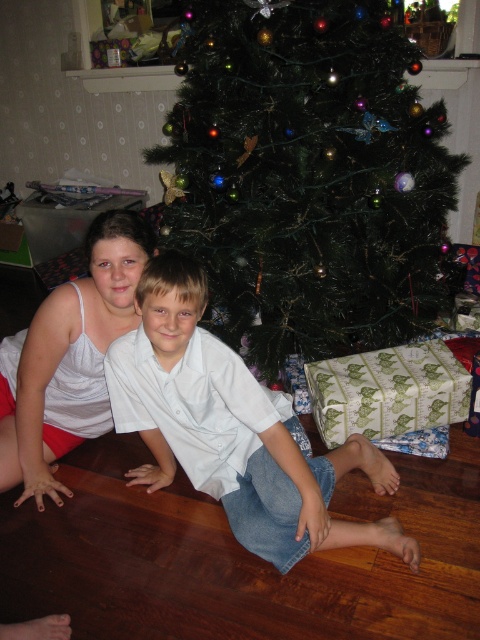
What is the exact coordinate of the white cotton tank top at center?

The white cotton tank top at center is located at point (69, 356).

You are organizing a Christmas photo shoot and need to ensure that all items are visible in the frame. The camera is positioned to capture the Christmas tree and the two people sitting in front of it. Considering the white cotton tank top at center and the green striped paper at lower right, which item is positioned higher up in the image?

The white cotton tank top at center is taller than the green striped paper at lower right, so it is positioned higher up in the image.